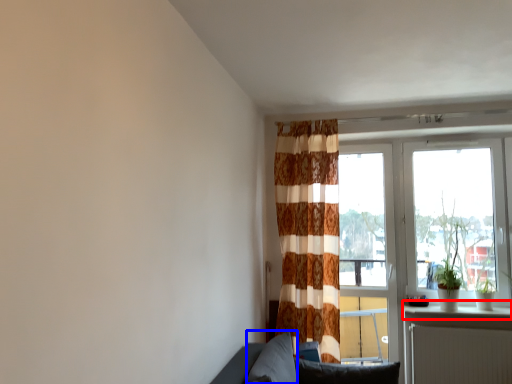
Question: Among these objects, which one is nearest to the camera, window sill (highlighted by a red box) or pillow (highlighted by a blue box)?

Choices:
 (A) window sill
 (B) pillow

Answer: (B)